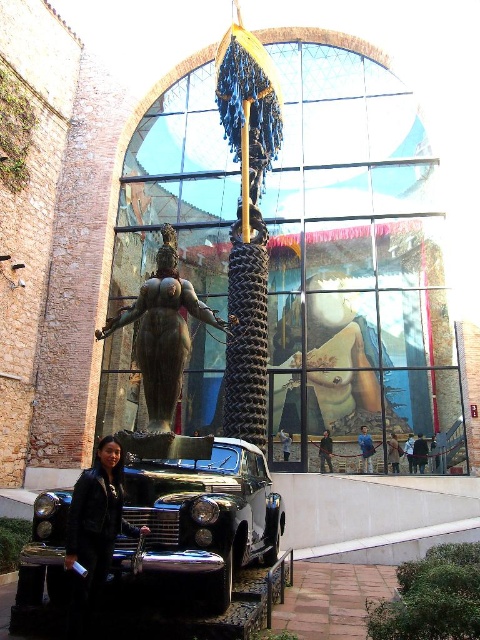
You are standing in the courtyard looking at the art installation. There are two points marked on the sculpture. Which point, point (180, 538) or point (90, 529), is closer to you?

Point (180, 538) is closer to you because it is further to the viewer than point (90, 529).

Looking at this image, you are an art critic standing in front of the bronze statue at center. You want to take a photo of the shiny chrome car at center without moving your position. Is the car visible in your current line of sight?

The shiny chrome car at center is to the right of bronze statue at center, so if you are standing in front of the bronze statue at center, the car should be visible to your right side without needing to move.

You are an artist planning to photograph the shiny chrome car at center and the black leather jacket at lower left. You need to know which object is wider to frame your shot properly. Which one is wider?

The shiny chrome car at center is wider than the black leather jacket at lower left according to the description.